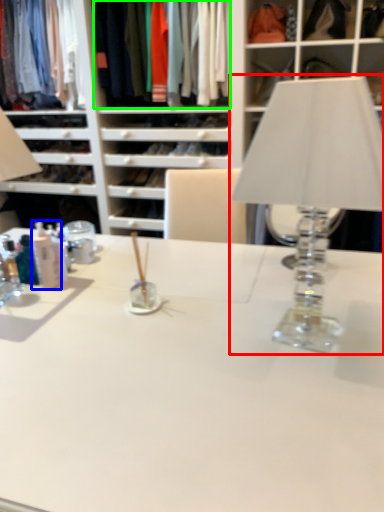
Question: Based on their relative distances, which object is nearer to table lamp (highlighted by a red box)? Choose from toiletry (highlighted by a blue box) and clothing (highlighted by a green box).

Choices:
 (A) toiletry
 (B) clothing

Answer: (A)